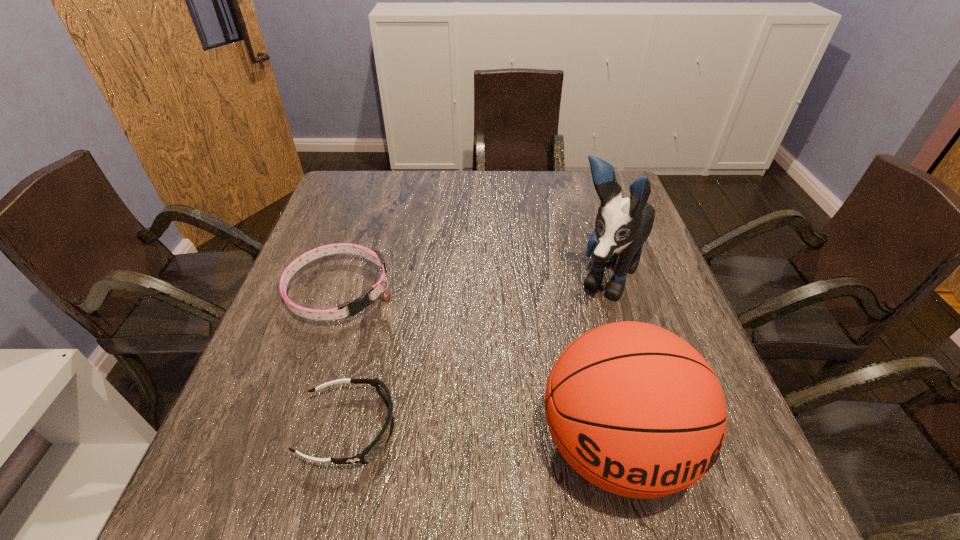
I want to click on free space on the desktop that is between the goggles and the third shortest object and is positioned with the buckle on the dog collar, so click(497, 438).

You are a GUI agent. You are given a task and a screenshot of the screen. Output one action in this format:
    pyautogui.click(x=<x>, y=<y>)
    Task: Click on the free spot on the desktop that is between the goggles and the basketball and is positioned on the front-facing side of the puppy
    This screenshot has width=960, height=540.
    Given the screenshot: What is the action you would take?
    pyautogui.click(x=505, y=438)